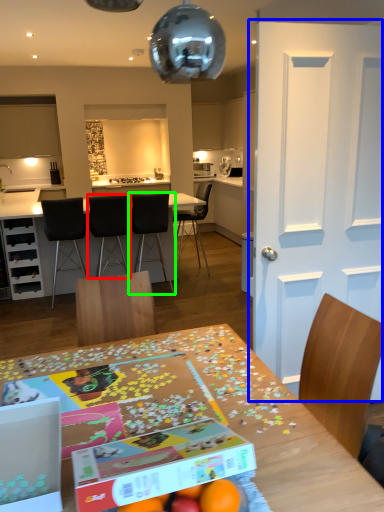
Question: Which object is the closest to the chair (highlighted by a red box)? Choose among these: door (highlighted by a blue box) or chair (highlighted by a green box).

Choices:
 (A) door
 (B) chair

Answer: (B)